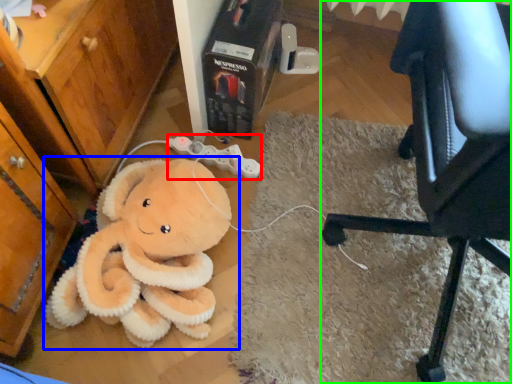
Question: Which object is positioned farthest from game controller (highlighted by a red box)? Select from toy (highlighted by a blue box) and chair (highlighted by a green box).

Choices:
 (A) toy
 (B) chair

Answer: (B)